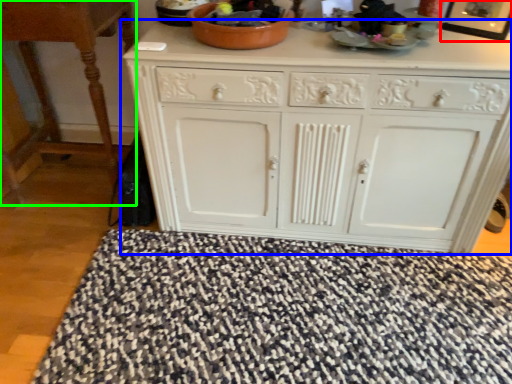
Question: Which object is the farthest from picture frame (highlighted by a red box)? Choose among these: chest of drawers (highlighted by a blue box) or table (highlighted by a green box).

Choices:
 (A) chest of drawers
 (B) table

Answer: (B)